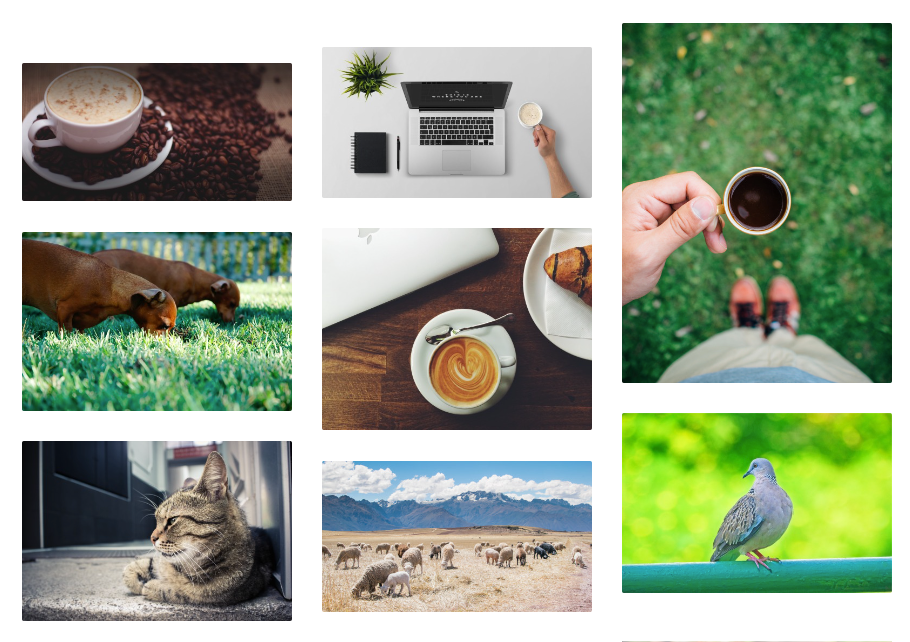
The width and height of the screenshot is (910, 642). In order to click on cup in this screenshot , I will do `click(507, 363)`, `click(726, 204)`.